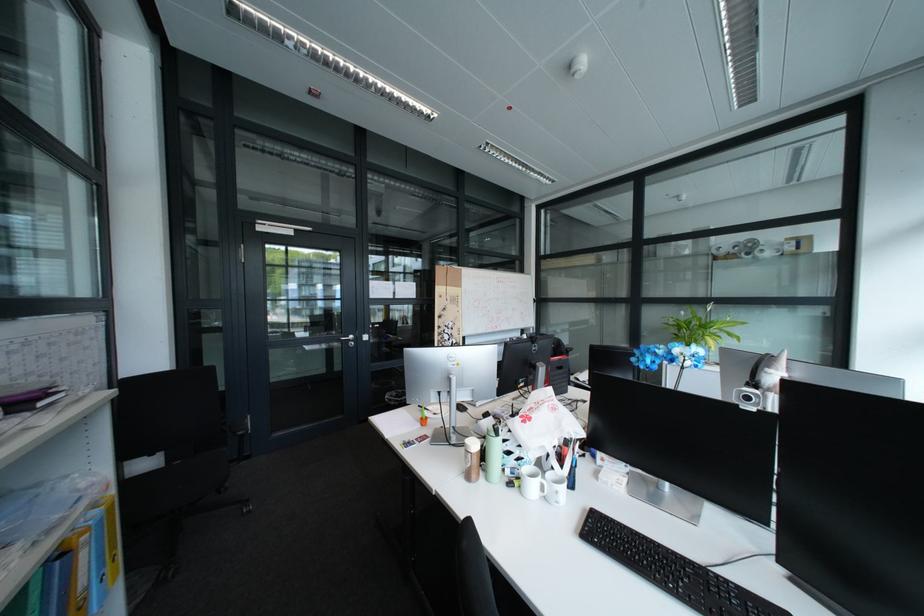
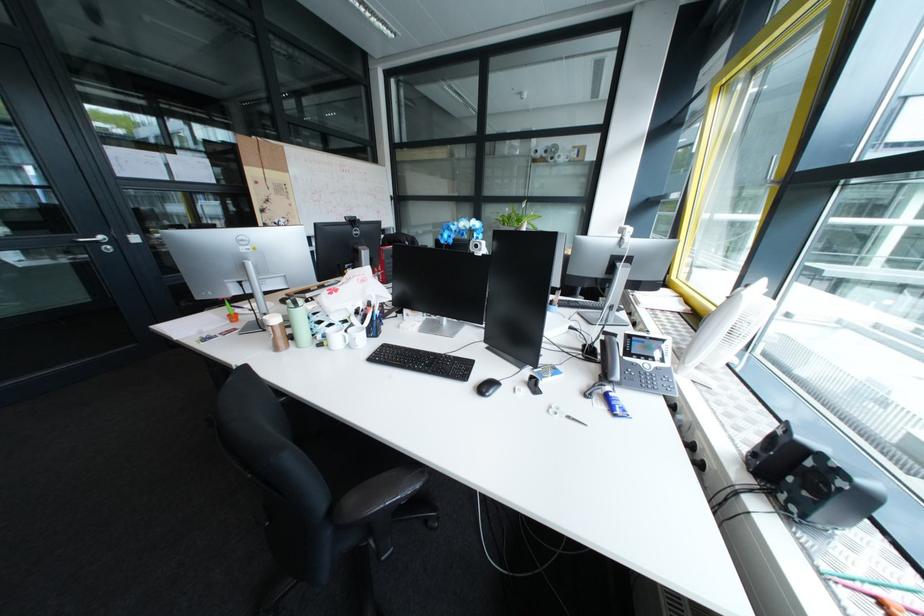
Where in the second image is the point corresponding to [481,464] from the first image?

(284, 338)